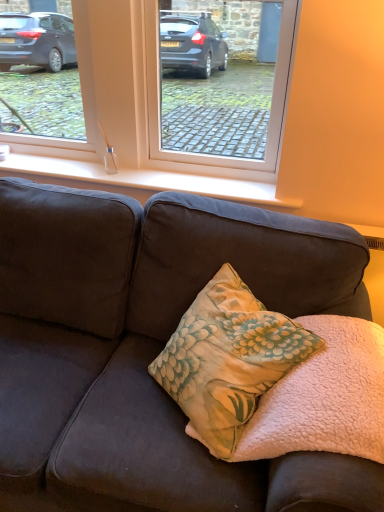
Question: Is matte glass window at upper center bigger than white glossy glass at center?

Choices:
 (A) yes
 (B) no

Answer: (A)

Question: Are matte glass window at upper center and white glossy glass at center making contact?

Choices:
 (A) yes
 (B) no

Answer: (B)

Question: From a real-world perspective, is matte glass window at upper center on top of white glossy glass at center?

Choices:
 (A) no
 (B) yes

Answer: (B)

Question: From the image's perspective, is matte glass window at upper center over white glossy glass at center?

Choices:
 (A) yes
 (B) no

Answer: (A)

Question: Is matte glass window at upper center closer to camera compared to white glossy glass at center?

Choices:
 (A) no
 (B) yes

Answer: (B)

Question: From a real-world perspective, is matte glass window at upper center under white glossy glass at center?

Choices:
 (A) no
 (B) yes

Answer: (A)

Question: Does matte glass window at upper center appear on the left side of fluffy pink blanket at center?

Choices:
 (A) yes
 (B) no

Answer: (A)

Question: Can you confirm if matte glass window at upper center is wider than fluffy pink blanket at center?

Choices:
 (A) no
 (B) yes

Answer: (A)

Question: Considering the relative sizes of matte glass window at upper center and fluffy pink blanket at center in the image provided, is matte glass window at upper center taller than fluffy pink blanket at center?

Choices:
 (A) yes
 (B) no

Answer: (A)

Question: From the image's perspective, is matte glass window at upper center located beneath fluffy pink blanket at center?

Choices:
 (A) yes
 (B) no

Answer: (B)

Question: Is matte glass window at upper center facing away from fluffy pink blanket at center?

Choices:
 (A) no
 (B) yes

Answer: (A)

Question: Would you say matte glass window at upper center is a long distance from fluffy pink blanket at center?

Choices:
 (A) yes
 (B) no

Answer: (B)

Question: Can you confirm if fluffy pink blanket at center is bigger than matte glass window at upper center?

Choices:
 (A) no
 (B) yes

Answer: (A)